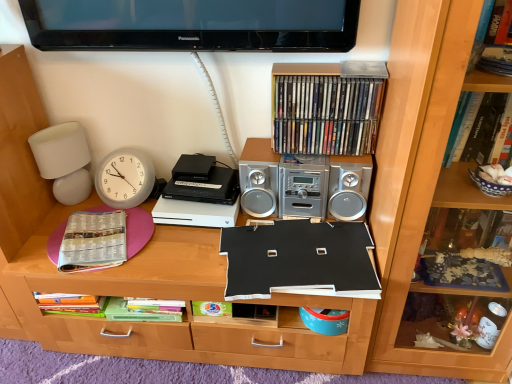
Identify the location of empty space that is ontop of black plastic cassette at center (from a real-world perspective). (196, 173).